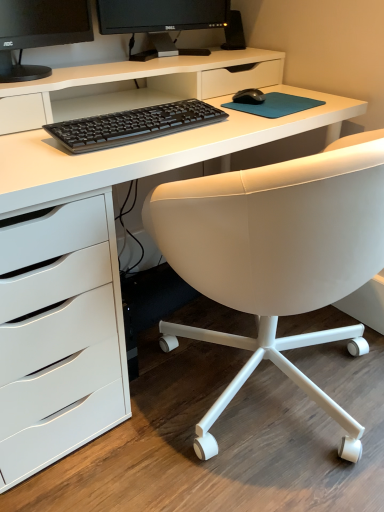
Question: From a real-world perspective, does white leather chair at center stand above black matte mouse at center?

Choices:
 (A) no
 (B) yes

Answer: (A)

Question: Is white leather chair at center bigger than black matte mouse at center?

Choices:
 (A) yes
 (B) no

Answer: (A)

Question: Does white leather chair at center have a lesser width compared to black matte mouse at center?

Choices:
 (A) no
 (B) yes

Answer: (A)

Question: Is white leather chair at center facing towards black matte mouse at center?

Choices:
 (A) no
 (B) yes

Answer: (B)

Question: From the image's perspective, would you say white leather chair at center is positioned over black matte mouse at center?

Choices:
 (A) no
 (B) yes

Answer: (A)

Question: Based on their positions, is white leather chair at center located to the left or right of black glossy monitor at upper center?

Choices:
 (A) left
 (B) right

Answer: (B)

Question: From the image's perspective, relative to black glossy monitor at upper center, is white leather chair at center above or below?

Choices:
 (A) above
 (B) below

Answer: (B)

Question: Is white leather chair at center situated inside black glossy monitor at upper center or outside?

Choices:
 (A) outside
 (B) inside

Answer: (A)

Question: In terms of height, does white leather chair at center look taller or shorter compared to black glossy monitor at upper center?

Choices:
 (A) short
 (B) tall

Answer: (B)

Question: Considering the positions of point (107, 136) and point (241, 91), is point (107, 136) closer or farther from the camera than point (241, 91)?

Choices:
 (A) closer
 (B) farther

Answer: (A)

Question: In the image, is black matte keyboard at center positioned in front of or behind black matte mouse at center?

Choices:
 (A) behind
 (B) front

Answer: (B)

Question: Is black matte keyboard at center inside or outside of black matte mouse at center?

Choices:
 (A) outside
 (B) inside

Answer: (A)

Question: In terms of size, does black matte keyboard at center appear bigger or smaller than black matte mouse at center?

Choices:
 (A) big
 (B) small

Answer: (A)

Question: From a real-world perspective, is white leather chair at center physically located above or below black matte mouse at center?

Choices:
 (A) above
 (B) below

Answer: (B)

Question: Visually, is white leather chair at center positioned to the left or to the right of black matte mouse at center?

Choices:
 (A) left
 (B) right

Answer: (B)